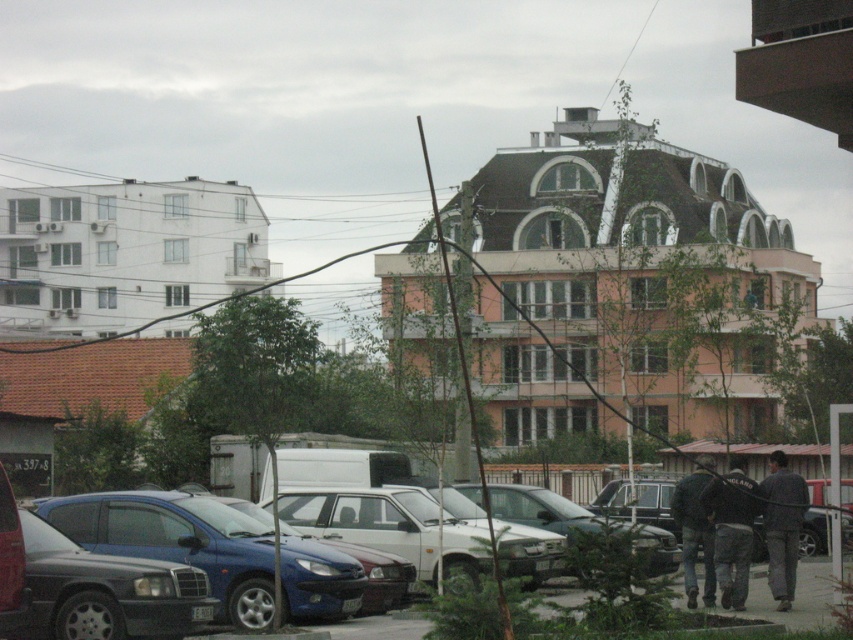
You are standing in the urban scene and want to determine the relative positions of two points marked in the image. Which point is closer to you, point 1 at coordinates (x=784, y=609) or point 2 at coordinates (x=693, y=516)?

Point 1 at coordinates (x=784, y=609) is closer to the viewer than point 2 at coordinates (x=693, y=516).